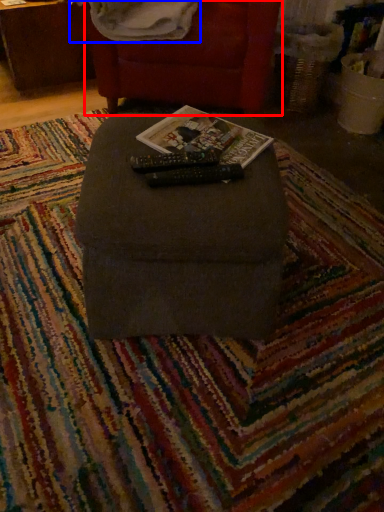
Question: Which of the following is the closest to the observer, furniture (highlighted by a red box) or blanket (highlighted by a blue box)?

Choices:
 (A) furniture
 (B) blanket

Answer: (B)